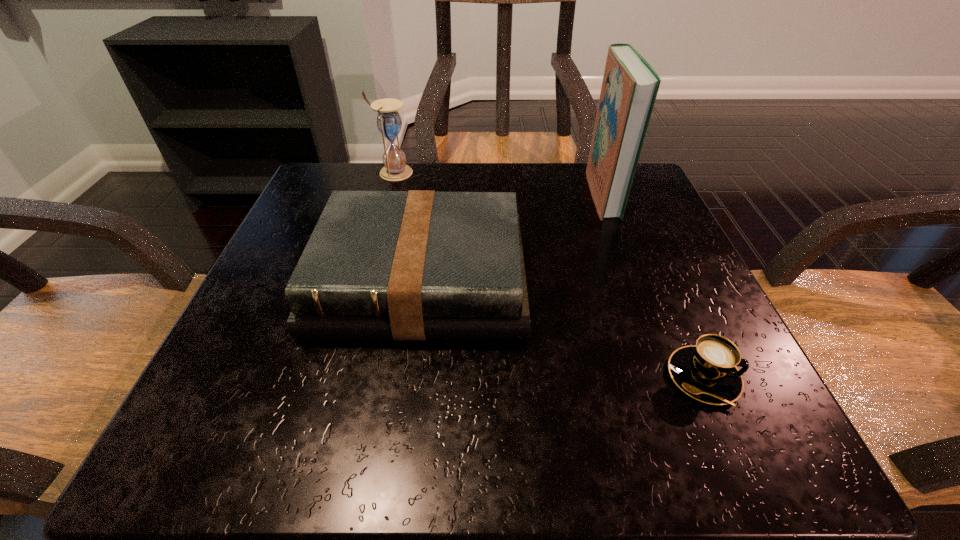
The height and width of the screenshot is (540, 960). What are the coordinates of `the tallest object` in the screenshot? It's located at (630, 85).

The image size is (960, 540). Find the location of `the farther hardback book`. the farther hardback book is located at coordinates (630, 85).

I want to click on the second tallest object, so click(x=389, y=123).

This screenshot has width=960, height=540. Find the location of `the left hardback book`. the left hardback book is located at coordinates (413, 265).

Where is `the shorter hardback book`? The height and width of the screenshot is (540, 960). the shorter hardback book is located at coordinates [413, 265].

Locate an element on the screen. the nearest object is located at coordinates (707, 372).

You are a GUI agent. You are given a task and a screenshot of the screen. Output one action in this format:
    pyautogui.click(x=<x>, y=<y>)
    Task: Click on the shortest object
    
    Given the screenshot: What is the action you would take?
    pyautogui.click(x=707, y=372)

Locate an element on the screen. vacant area situated on the cover of the tallest object is located at coordinates (449, 194).

Locate an element on the screen. This screenshot has width=960, height=540. vacant space situated on the cover of the tallest object is located at coordinates (516, 194).

Image resolution: width=960 pixels, height=540 pixels. I want to click on vacant space situated on the cover of the tallest object, so 524,194.